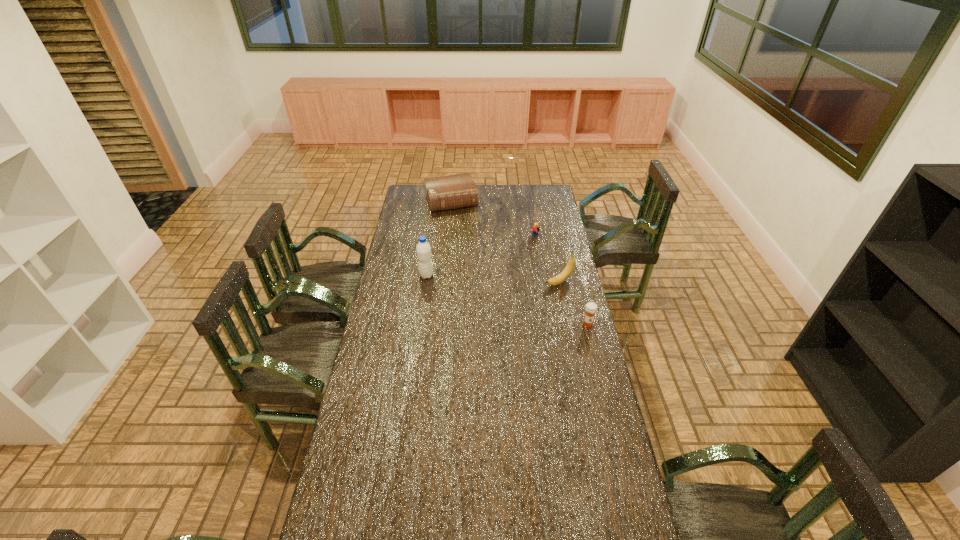
Identify the location of free spot between the banana and the farthest object. (505, 241).

The width and height of the screenshot is (960, 540). What are the coordinates of `free spot between the fourth shortest object and the farthest object` in the screenshot? It's located at (505, 241).

What are the coordinates of `free space that is in between the water bottle and the Bible` in the screenshot? It's located at (439, 239).

Locate an element on the screen. This screenshot has height=540, width=960. free space between the Bible and the nearest object is located at coordinates (519, 263).

Locate an element on the screen. The image size is (960, 540). free space between the fourth nearest object and the water bottle is located at coordinates (481, 256).

What are the coordinates of `vacant area between the fourth shortest object and the farthest object` in the screenshot? It's located at (505, 241).

Locate an element on the screen. object that stands as the second closest to the Lego is located at coordinates (450, 192).

Point out which object is positioned as the nearest to the Bible. Please provide its 2D coordinates. Your answer should be formatted as a tuple, i.e. [(x, y)], where the tuple contains the x and y coordinates of a point satisfying the conditions above.

[(535, 229)]

Where is `free space that satisfies the following two spatial constraints: 1. on the back side of the Bible; 2. on the left side of the water bottle`? free space that satisfies the following two spatial constraints: 1. on the back side of the Bible; 2. on the left side of the water bottle is located at coordinates (437, 201).